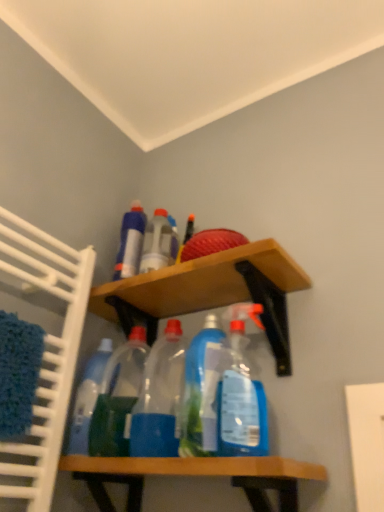
Question: Looking at their shapes, would you say blue plastic bottle at upper center, marked as the 6th bottle in a right-to-left arrangement, is wider or thinner than wooden shelf at upper center, which ranks as the second shelf in bottom-to-top order?

Choices:
 (A) thin
 (B) wide

Answer: (A)

Question: Does point (117, 260) appear closer or farther from the camera than point (238, 260)?

Choices:
 (A) farther
 (B) closer

Answer: (A)

Question: Which object is the closest to the wooden shelf at upper center, which ranks as the second shelf in bottom-to-top order?

Choices:
 (A) transparent plastic bottles at center, the fourth bottle positioned from the left
 (B) blue plastic bottle at upper center, the first bottle viewed from the left
 (C) wooden shelf at lower center, the first shelf from the bottom
 (D) blue translucent spray bottle at center, marked as the 1th bottle in a right-to-left arrangement
 (E) blue translucent bottle at center, the 5th bottle when ordered from left to right

Answer: (D)

Question: Which is farther from the blue translucent bottle at center, placed as the second bottle when sorted from right to left?

Choices:
 (A) transparent plastic bottles at center, the fourth bottle positioned from the left
 (B) blue plastic bottle at upper center, marked as the 6th bottle in a right-to-left arrangement
 (C) transparent plastic bottle at center, which is the fifth bottle from right to left
 (D) translucent plastic bottle at upper center, which is counted as the 3th bottle, starting from the left
 (E) wooden shelf at lower center, the second shelf when ordered from top to bottom

Answer: (B)